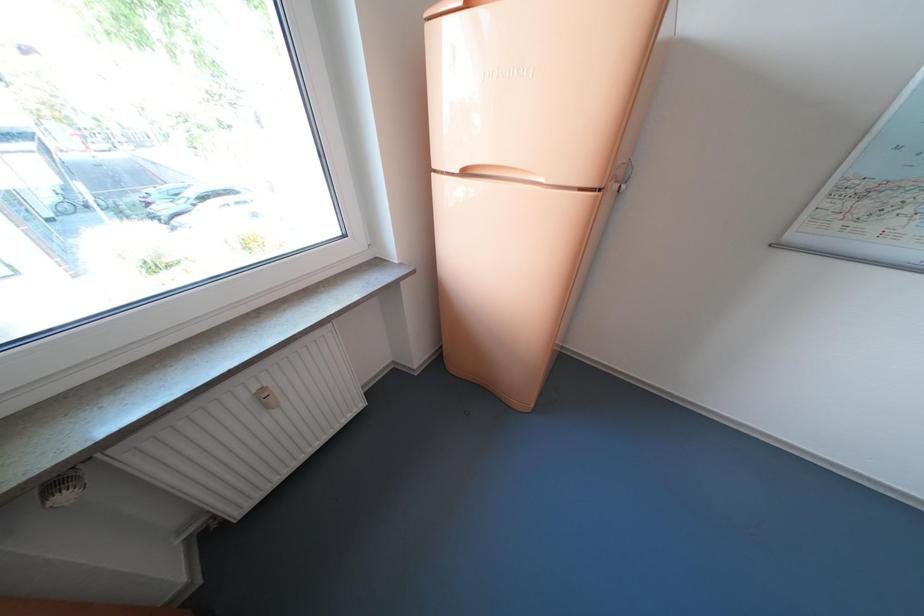
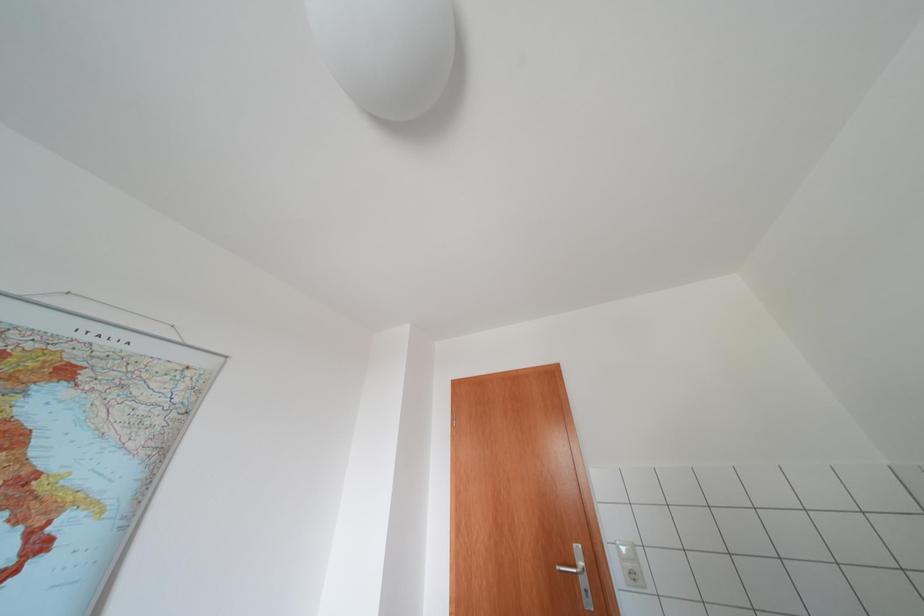
First-person continuous shooting, in which direction is the camera rotating?

The camera rotated toward right-up.